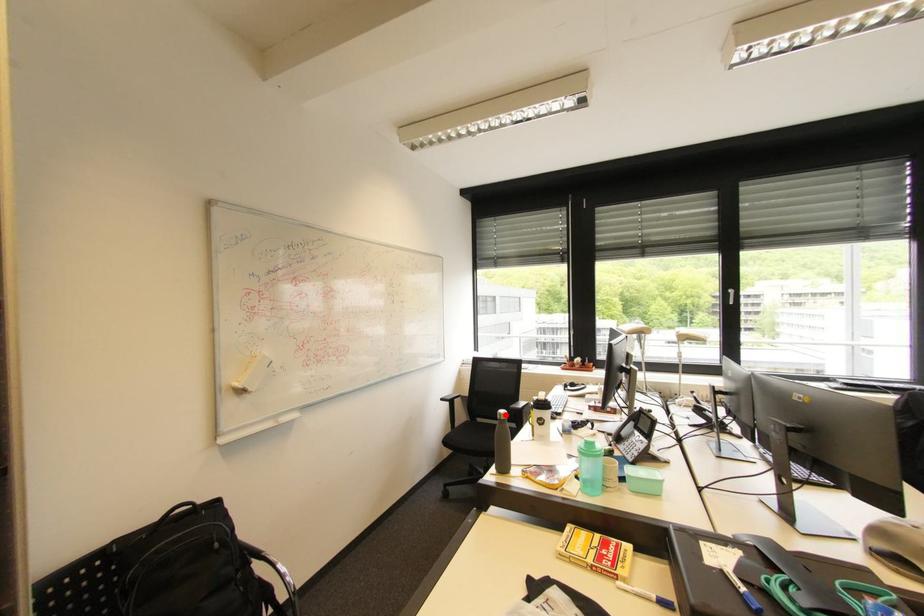
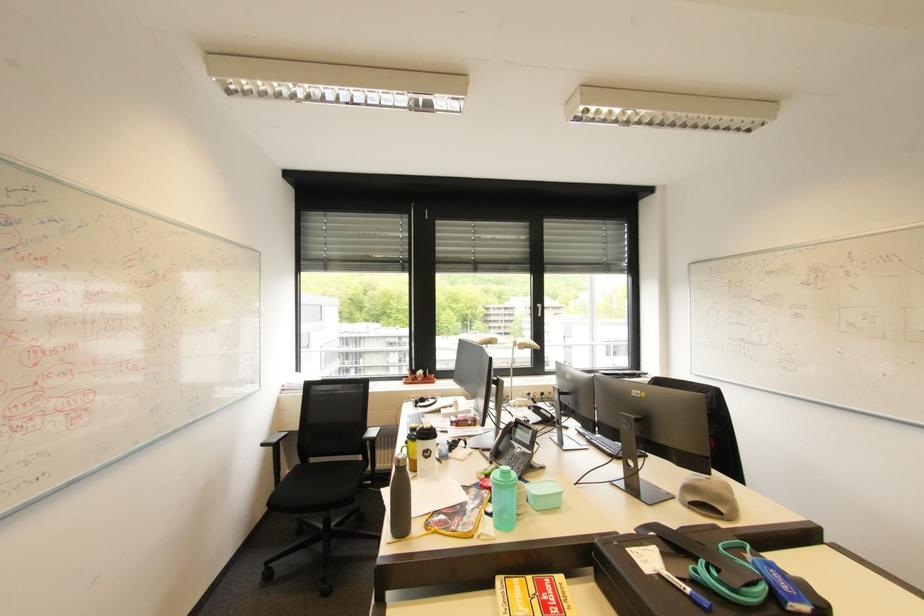
The point at the highlighted location is marked in the first image. Where is the corresponding point in the second image?

(405, 461)